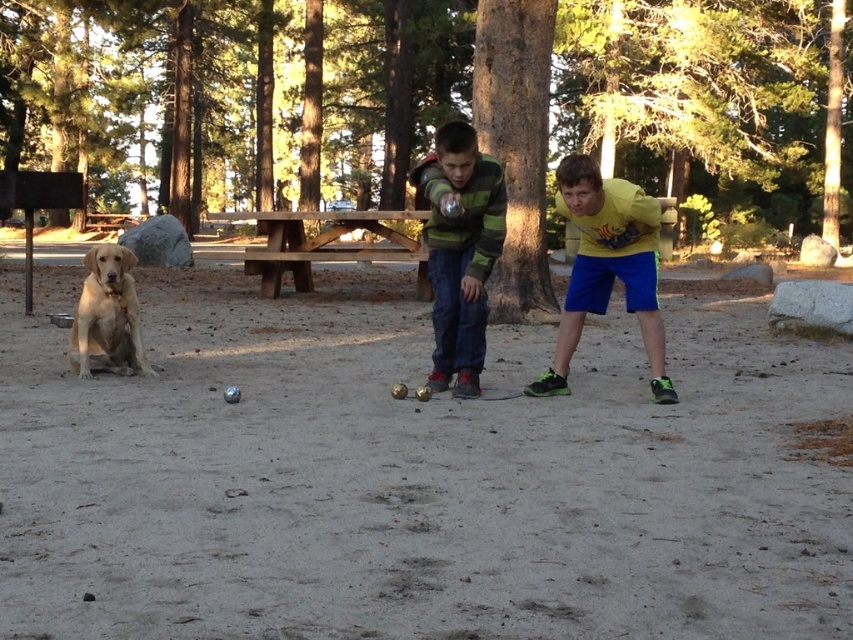
In the scene shown: You are a photographer trying to capture a photo of both the green striped sweater at center and the golden fur dog at left. Since you want both subjects to appear equally prominent in the photo, which one should you zoom in on more?

Since the green striped sweater at center is bigger than the golden fur dog at left, you should zoom in more on the golden fur dog at left to make them appear equally prominent in the photo.

You are a photographer trying to capture a photo of both the green striped sweater at center and the golden fur dog at left. Since you want both subjects to be clearly visible in the frame, which subject should you focus on first to ensure the other remains in focus?

You should focus on the green striped sweater at center first because it is in front of the golden fur dog at left, so by focusing on the closer subject, the background subject will still be in focus.

What is located at the point with coordinates (460, 250) in the image?

The point at coordinates (460, 250) is located on the green striped sweater at center.